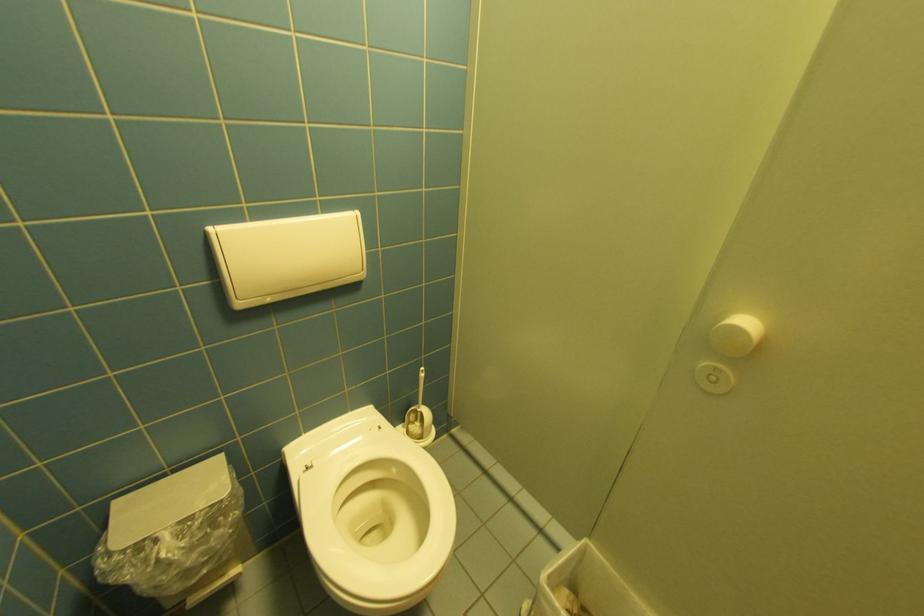
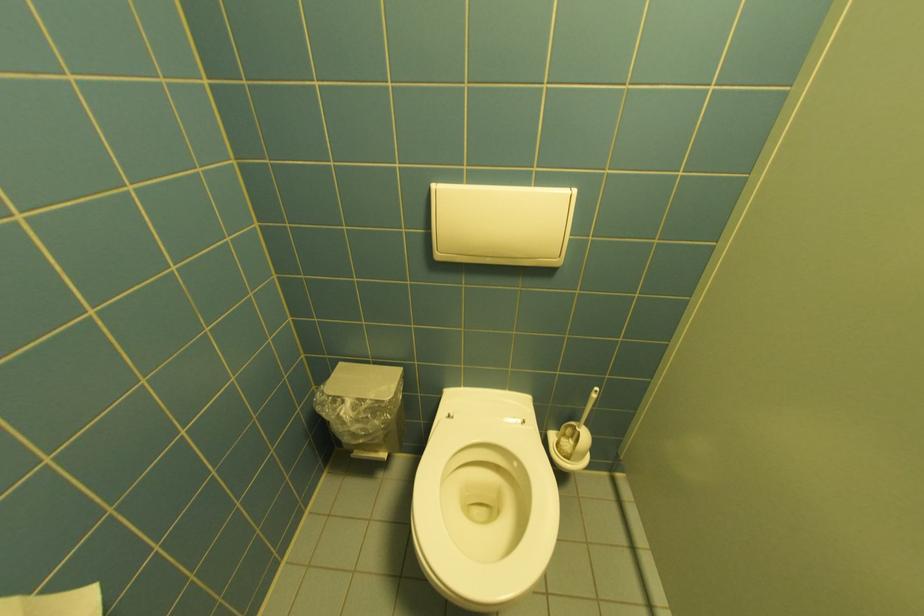
The point at (120, 504) is marked in the first image. Where is the corresponding point in the second image?

(347, 365)